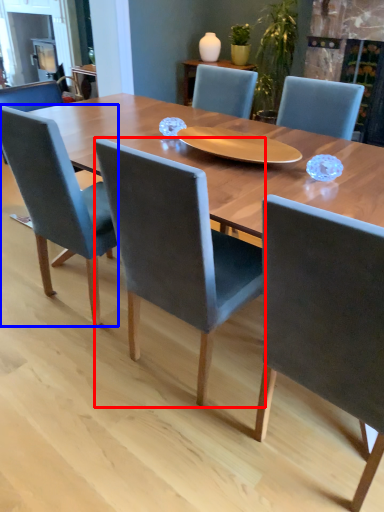
Question: Which object is closer to the camera taking this photo, chair (highlighted by a red box) or chair (highlighted by a blue box)?

Choices:
 (A) chair
 (B) chair

Answer: (A)